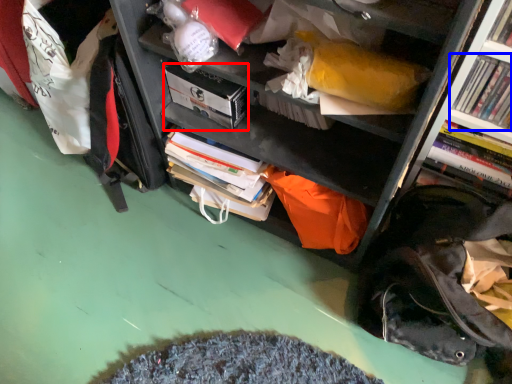
Question: Which point is closer to the camera, paperback book (highlighted by a red box) or book (highlighted by a blue box)?

Choices:
 (A) paperback book
 (B) book

Answer: (B)